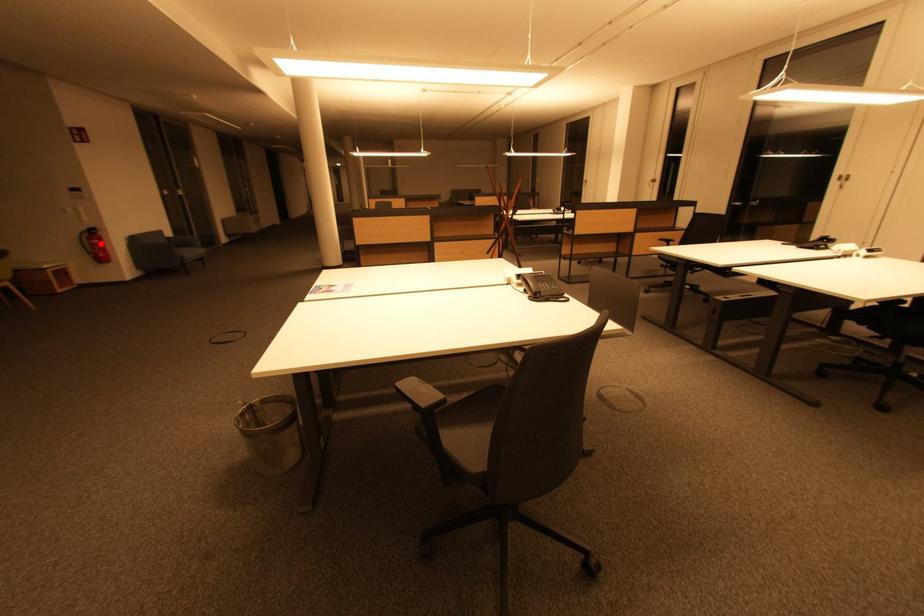
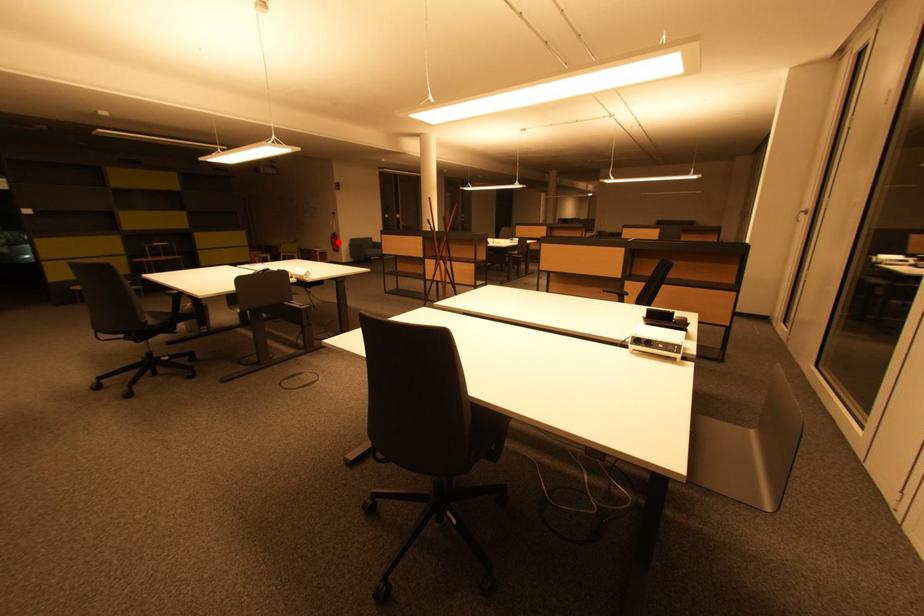
I am providing you with two images of the same scene from different viewpoints. A red point is marked on the first image and another point is marked on the second image. Is the red point in image1 aligned with the point shown in image2?

Yes